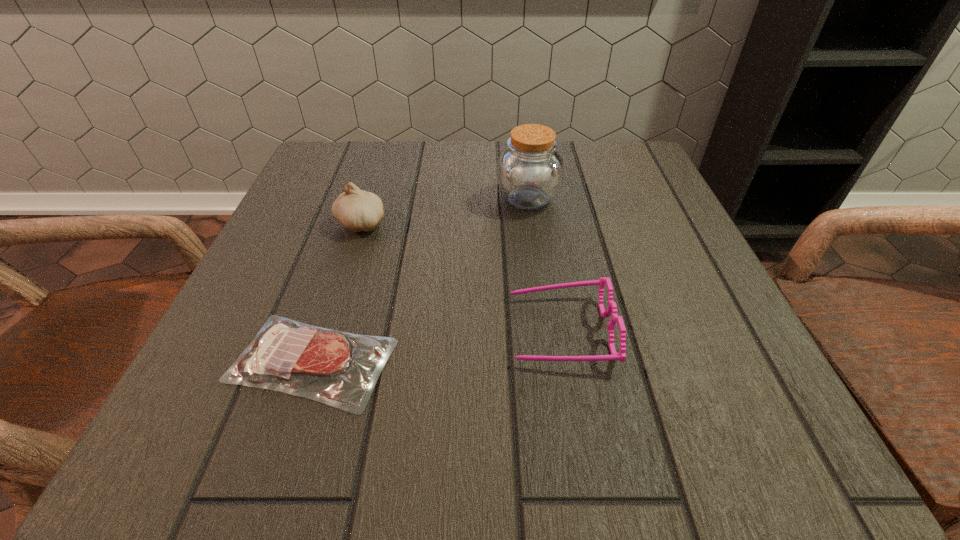
The image size is (960, 540). In order to click on vacant space at the near left corner in this screenshot , I will do `click(263, 397)`.

You are a GUI agent. You are given a task and a screenshot of the screen. Output one action in this format:
    pyautogui.click(x=<x>, y=<y>)
    Task: Click on the vacant space at the near right corner
    This screenshot has height=540, width=960.
    Given the screenshot: What is the action you would take?
    pyautogui.click(x=771, y=420)

Where is `empty space that is in between the shortest object and the jar`? The image size is (960, 540). empty space that is in between the shortest object and the jar is located at coordinates (420, 280).

Find the location of a particular element. The image size is (960, 540). free spot between the garlic and the spectacles is located at coordinates (461, 277).

Locate an element on the screen. The width and height of the screenshot is (960, 540). empty space that is in between the spectacles and the shortest object is located at coordinates (436, 346).

Where is `vacant area that lies between the jar and the third tallest object`? The image size is (960, 540). vacant area that lies between the jar and the third tallest object is located at coordinates (543, 265).

I want to click on free spot between the spectacles and the tallest object, so 543,265.

Where is `empty location between the shortest object and the garlic`? Image resolution: width=960 pixels, height=540 pixels. empty location between the shortest object and the garlic is located at coordinates (337, 292).

Locate an element on the screen. The height and width of the screenshot is (540, 960). vacant area between the second tallest object and the shortest object is located at coordinates (337, 292).

I want to click on vacant point located between the steak and the garlic, so click(x=337, y=292).